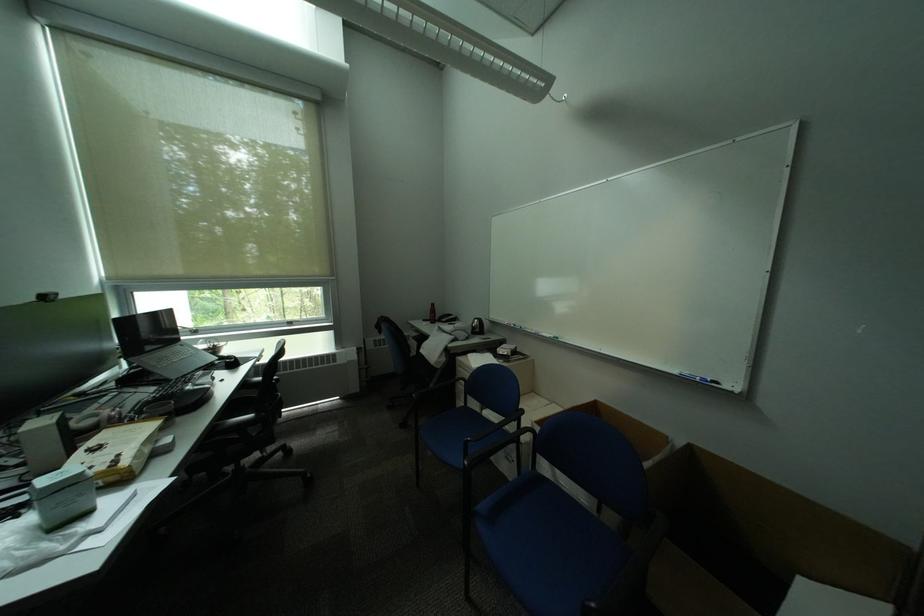
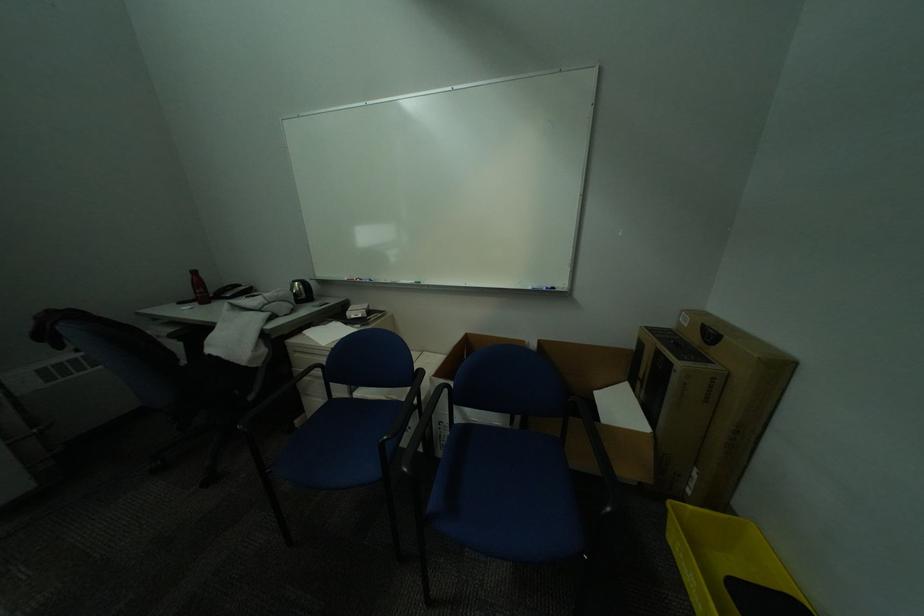
Locate, in the second image, the point that corresponds to [441,323] in the first image.

(208, 304)